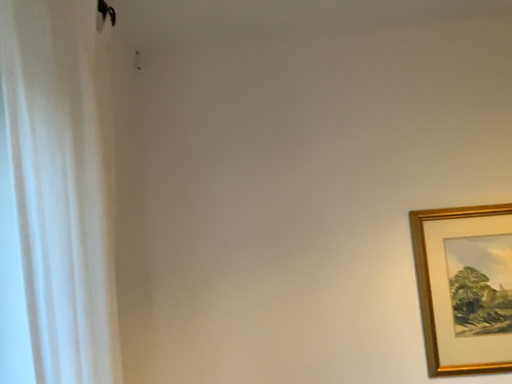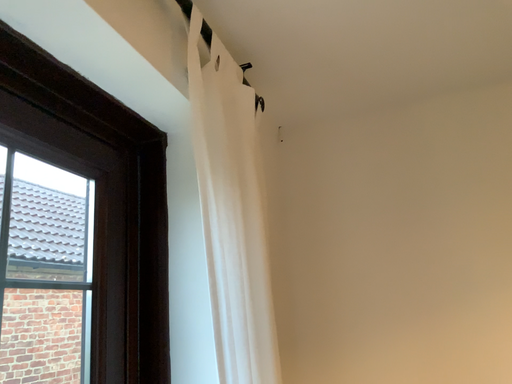
Question: Which way did the camera rotate in the video?

Choices:
 (A) rotated downward
 (B) rotated upward

Answer: (B)